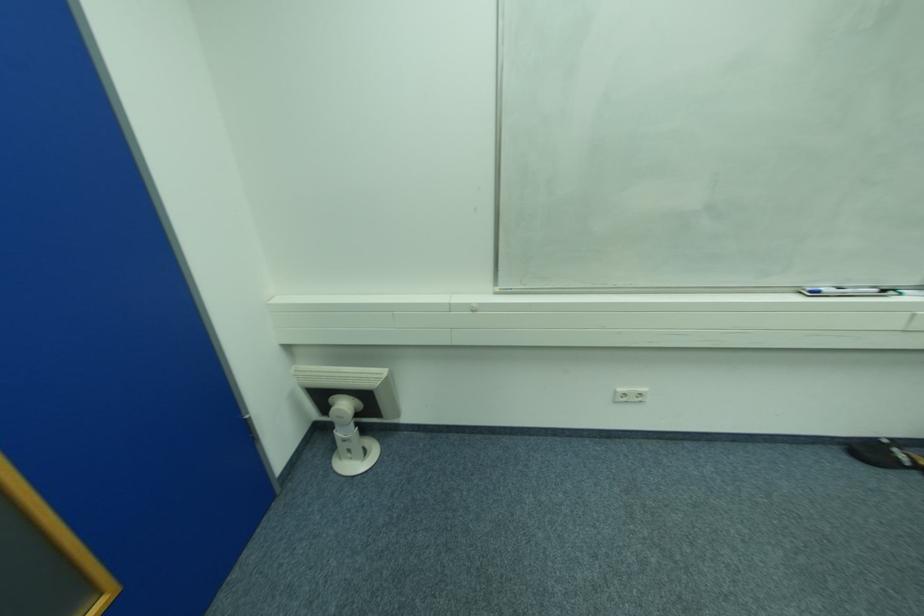
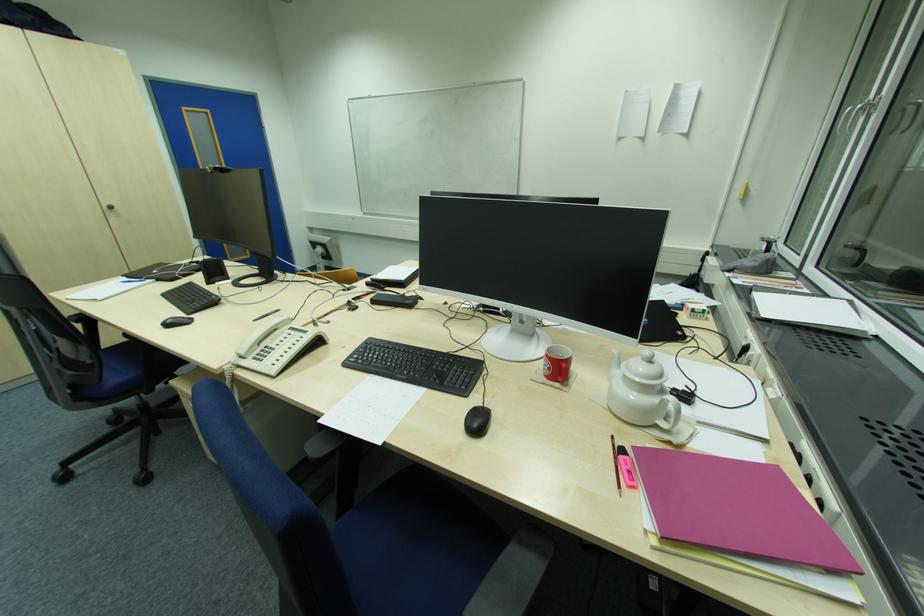
In a continuous first-person perspective shot, in which direction is the camera moving?

The cameraman moved toward right, backward.